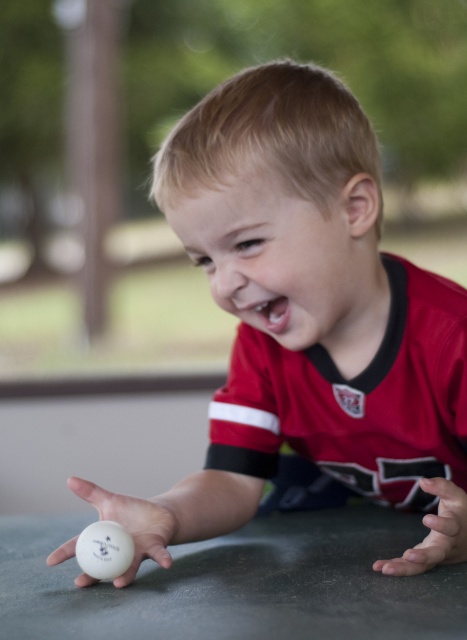
Between white smooth table at lower center and smooth skin hand at lower right, which one is positioned higher?

smooth skin hand at lower right is higher up.

Where is `white smooth table at lower center`? Image resolution: width=467 pixels, height=640 pixels. white smooth table at lower center is located at coordinates (238, 582).

Is white matte ping pong ball at lower left to the left of white smooth table at lower center from the viewer's perspective?

In fact, white matte ping pong ball at lower left is to the right of white smooth table at lower center.

Is point (290, 426) less distant than point (239, 636)?

No.

Image resolution: width=467 pixels, height=640 pixels. Find the location of `white matte ping pong ball at lower left`. white matte ping pong ball at lower left is located at coordinates (302, 310).

Measure the distance between white matte ping pong ball at lower left and smooth skin hand at lower right.

A distance of 10.06 inches exists between white matte ping pong ball at lower left and smooth skin hand at lower right.

Between white matte ping pong ball at lower left and smooth skin hand at lower right, which one is positioned lower?

smooth skin hand at lower right

Is point (207, 131) positioned in front of point (427, 518)?

No, (207, 131) is behind (427, 518).

The width and height of the screenshot is (467, 640). In order to click on white matte ping pong ball at lower left in this screenshot , I will do `click(302, 310)`.